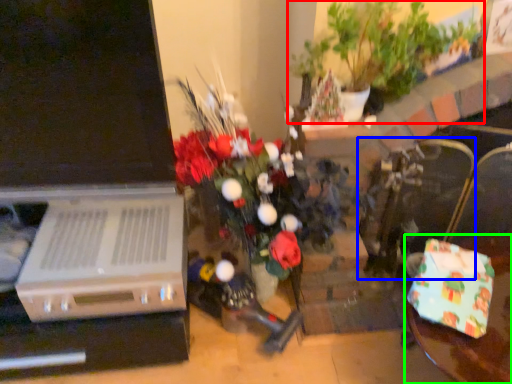
Question: Estimate the real-world distances between objects in this image. Which object is closer to houseplant (highlighted by a red box), armchair (highlighted by a blue box) or table (highlighted by a green box)?

Choices:
 (A) armchair
 (B) table

Answer: (A)